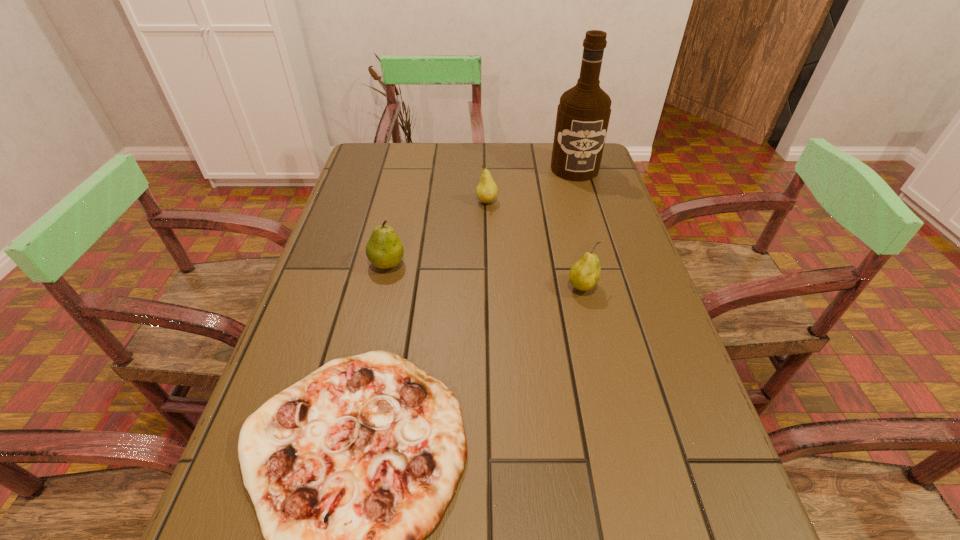
Locate an element on the screen. Image resolution: width=960 pixels, height=540 pixels. alcohol is located at coordinates pos(583,114).

The width and height of the screenshot is (960, 540). I want to click on the tallest object, so click(x=583, y=114).

At what (x,y) coordinates should I click in order to perform the action: click on the third object from right to left. Please return your answer as a coordinate pair (x, y). The height and width of the screenshot is (540, 960). Looking at the image, I should click on (487, 190).

At what (x,y) coordinates should I click in order to perform the action: click on the farthest pear. Please return your answer as a coordinate pair (x, y). Looking at the image, I should click on click(487, 190).

You are a GUI agent. You are given a task and a screenshot of the screen. Output one action in this format:
    pyautogui.click(x=<x>, y=<y>)
    Task: Click on the leftmost pear
    
    Given the screenshot: What is the action you would take?
    pyautogui.click(x=384, y=249)

This screenshot has width=960, height=540. I want to click on the rightmost pear, so click(584, 274).

I want to click on free space located on the label of the tallest object, so pyautogui.click(x=596, y=240).

Locate an element on the screen. The image size is (960, 540). free space located 0.140m on the left of the third object from right to left is located at coordinates (427, 202).

Locate an element on the screen. This screenshot has height=540, width=960. vacant space located on the right of the leftmost pear is located at coordinates (542, 264).

Locate an element on the screen. This screenshot has width=960, height=540. blank space located 0.250m on the back of the rightmost pear is located at coordinates (564, 213).